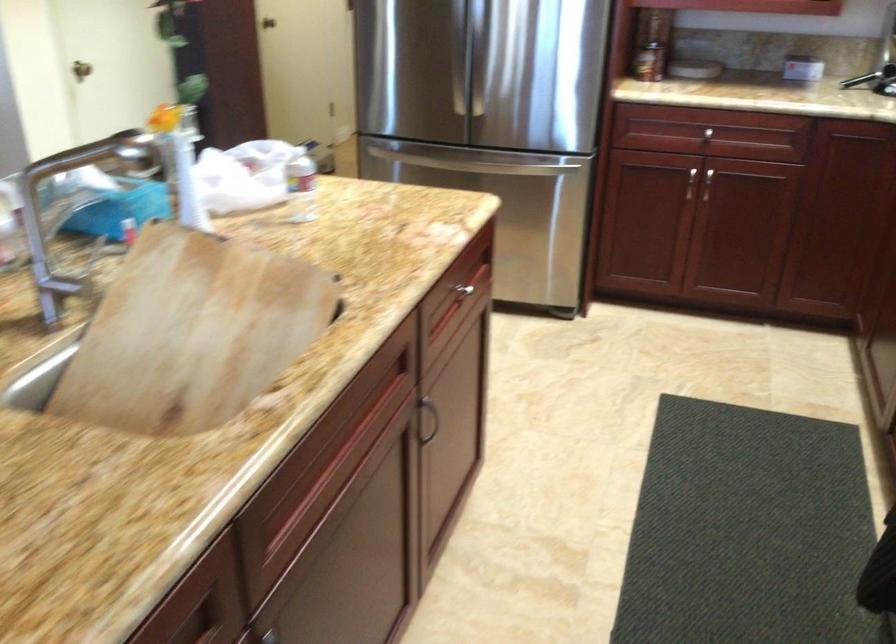
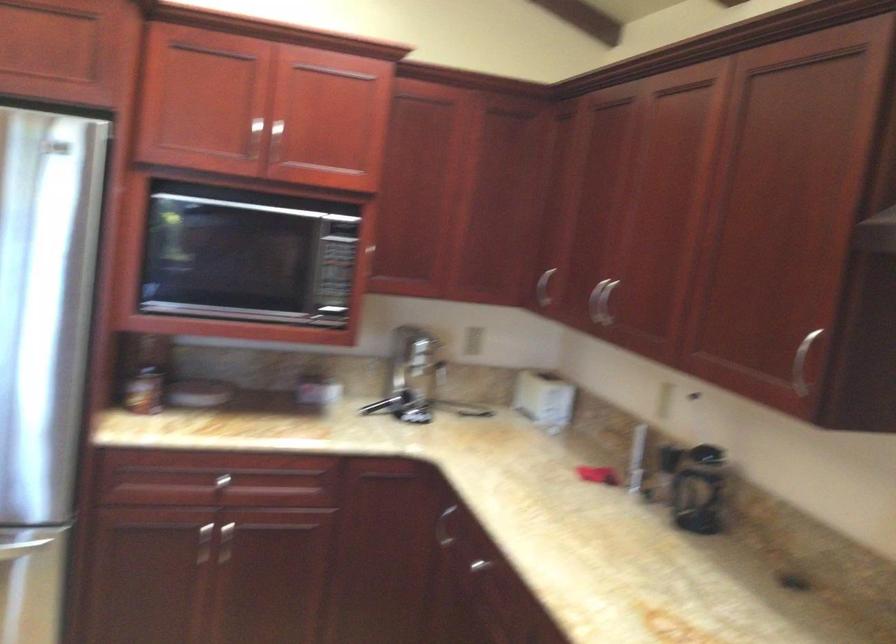
Find the pixel in the second image that matches [556,169] in the first image.

(21, 547)